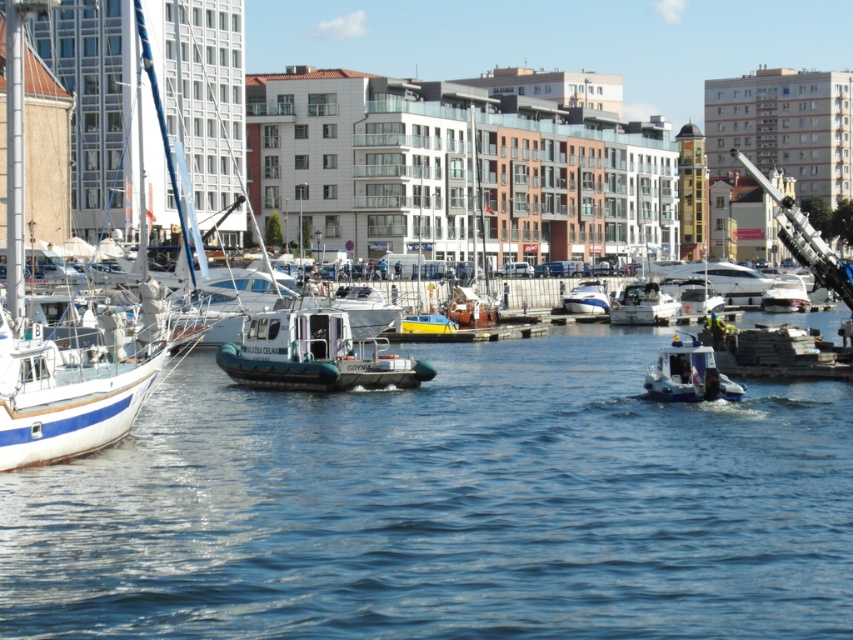
Question: Which of the following is the farthest from the observer?

Choices:
 (A) (577, 312)
 (B) (677, 388)
 (C) (631, 321)
 (D) (6, 449)

Answer: (A)

Question: Among these points, which one is nearest to the camera?

Choices:
 (A) (675, 364)
 (B) (352, 339)
 (C) (643, 310)

Answer: (A)

Question: In this image, where is green rubber boat at center located relative to white glossy speedboat at center?

Choices:
 (A) above
 (B) below

Answer: (B)

Question: Is white glossy sailboat at left smaller than green rubber boat at center?

Choices:
 (A) no
 (B) yes

Answer: (A)

Question: Which point is closer to the camera?

Choices:
 (A) (708, 381)
 (B) (564, 305)
 (C) (65, 371)
 (D) (383, 346)

Answer: (C)

Question: Is blue water at center above white glossy speedboat at center?

Choices:
 (A) yes
 (B) no

Answer: (B)